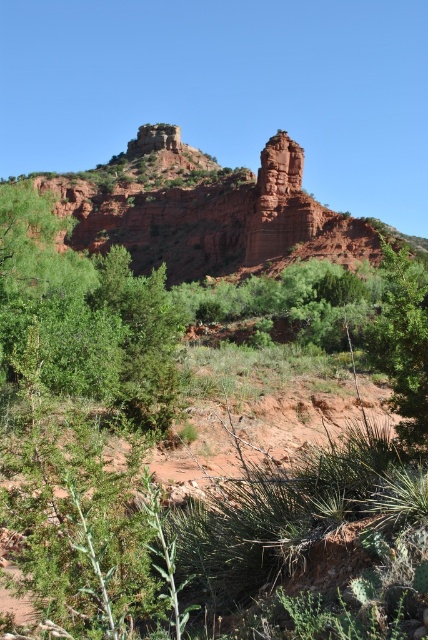
Who is more forward, (113, 365) or (377, 346)?

Point (377, 346) is more forward.

Can you confirm if green leafy tree at lower left is positioned to the left of green textured tree at lower right?

Yes, green leafy tree at lower left is to the left of green textured tree at lower right.

Is point (59, 360) less distant than point (409, 308)?

No, it is not.

At what (x,y) coordinates should I click in order to perform the action: click on green leafy tree at lower left. Please return your answer as a coordinate pair (x, y). Looking at the image, I should click on pyautogui.click(x=86, y=314).

Is green textured tree at lower right thinner than reddish-brown sandstone rock formation at center-right?

Incorrect, green textured tree at lower right's width is not less than reddish-brown sandstone rock formation at center-right's.

Does green textured tree at lower right have a smaller size compared to reddish-brown sandstone rock formation at center-right?

Actually, green textured tree at lower right might be larger than reddish-brown sandstone rock formation at center-right.

Is point (406, 387) less distant than point (264, 192)?

Yes, point (406, 387) is closer to viewer.

Identify the location of green textured tree at lower right. (403, 340).

Can you confirm if reddish-brown rock formation at center is smaller than green leafy tree at lower left?

No, reddish-brown rock formation at center is not smaller than green leafy tree at lower left.

Is point (321, 232) positioned after point (36, 268)?

Yes, point (321, 232) is behind point (36, 268).

Between point (112, 221) and point (20, 204), which one is positioned in front?

Positioned in front is point (20, 204).

The image size is (428, 640). What are the coordinates of `reddish-brown rock formation at center` in the screenshot? It's located at (207, 211).